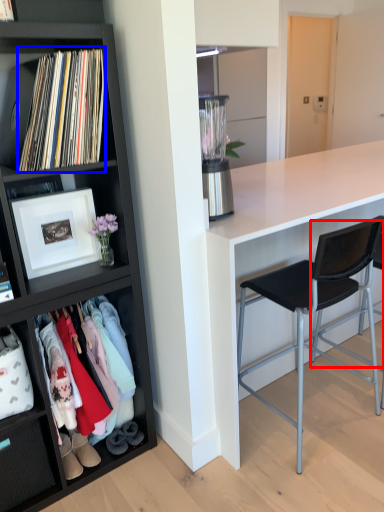
Question: Which of the following is the farthest to the observer, chair (highlighted by a red box) or book (highlighted by a blue box)?

Choices:
 (A) chair
 (B) book

Answer: (A)